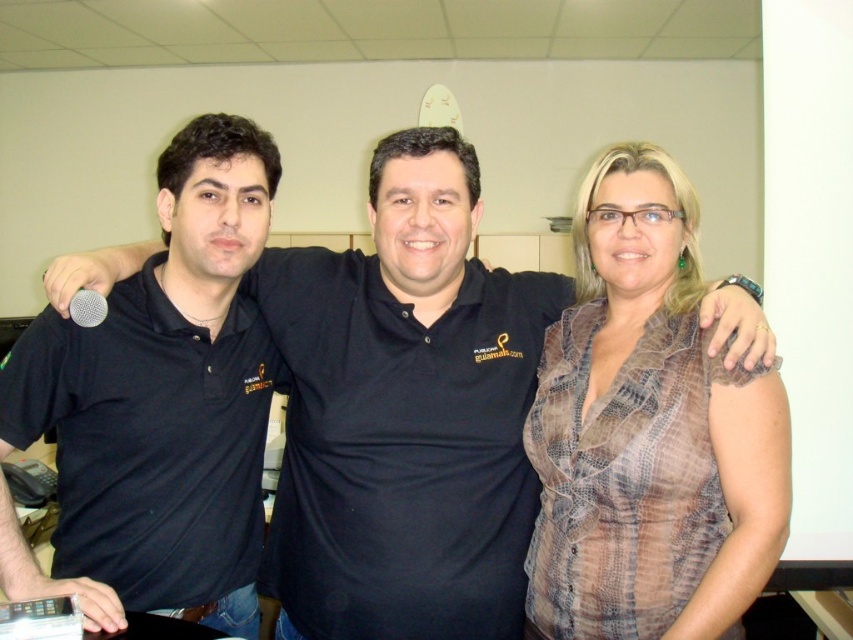
You are a photographer setting up for a group photo. You need to ensure that the plaid fabric blouse at center and the silver metallic microphone at left are both in focus. Given that your camera can focus on objects within a 30 inch range, will both items be in focus?

The distance between the plaid fabric blouse at center and the silver metallic microphone at left is 32.77 inches. Since the camera can only focus within a 30 inch range, the two items are slightly out of the focus range, so they might not both be in focus.